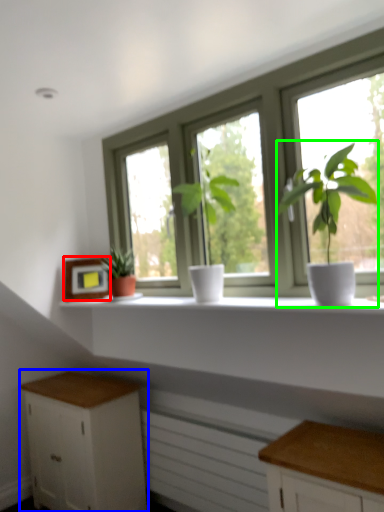
Question: Based on their relative distances, which object is nearer to picture frame (highlighted by a red box)? Choose from cabinetry (highlighted by a blue box) and houseplant (highlighted by a green box).

Choices:
 (A) cabinetry
 (B) houseplant

Answer: (A)